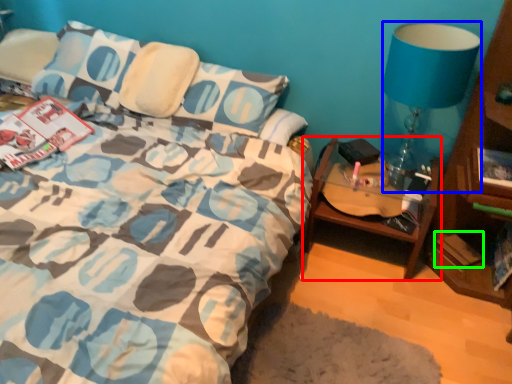
Question: Based on their relative distances, which object is nearer to table (highlighted by a red box)? Choose from lamp (highlighted by a blue box) and paperback book (highlighted by a green box).

Choices:
 (A) lamp
 (B) paperback book

Answer: (B)